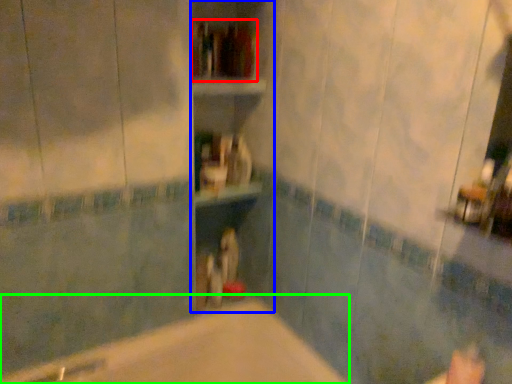
Question: Considering the real-world distances, which object is farthest from book (highlighted by a red box)? bookshelf (highlighted by a blue box) or bathtub (highlighted by a green box)?

Choices:
 (A) bookshelf
 (B) bathtub

Answer: (B)